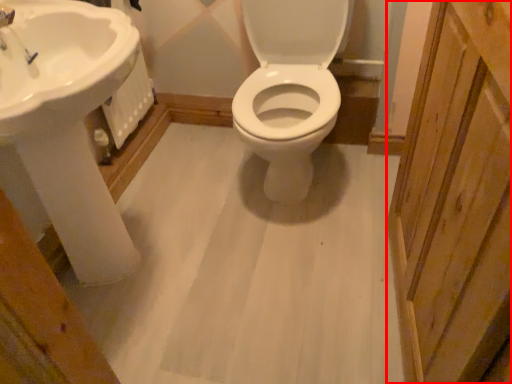
Question: From the image, what is the correct spatial relationship of screen door (annotated by the red box) in relation to sink?

Choices:
 (A) right
 (B) left

Answer: (A)